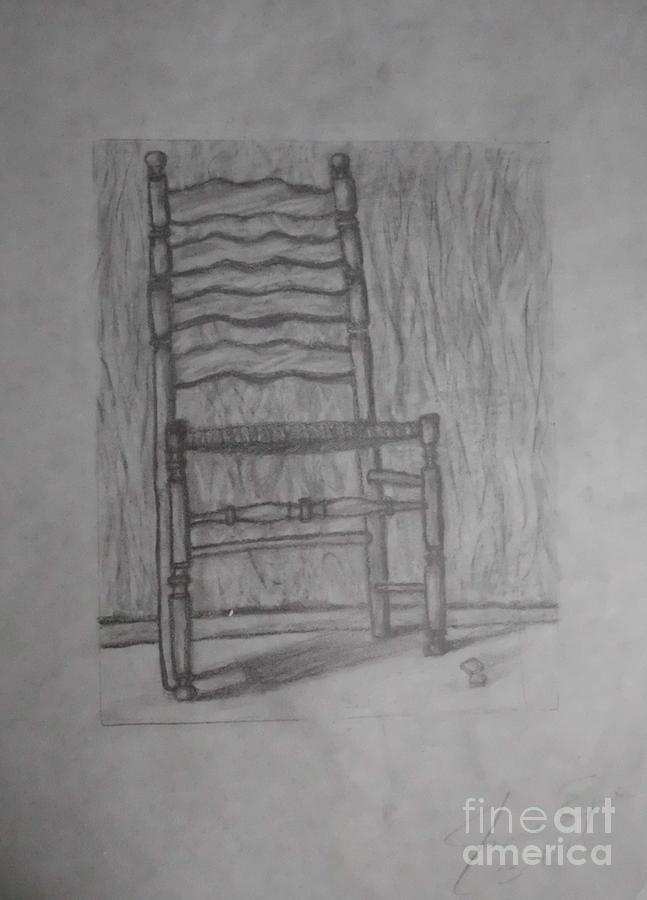
In order to click on shadow from baseboard in this screenshot , I will do `click(115, 618)`.